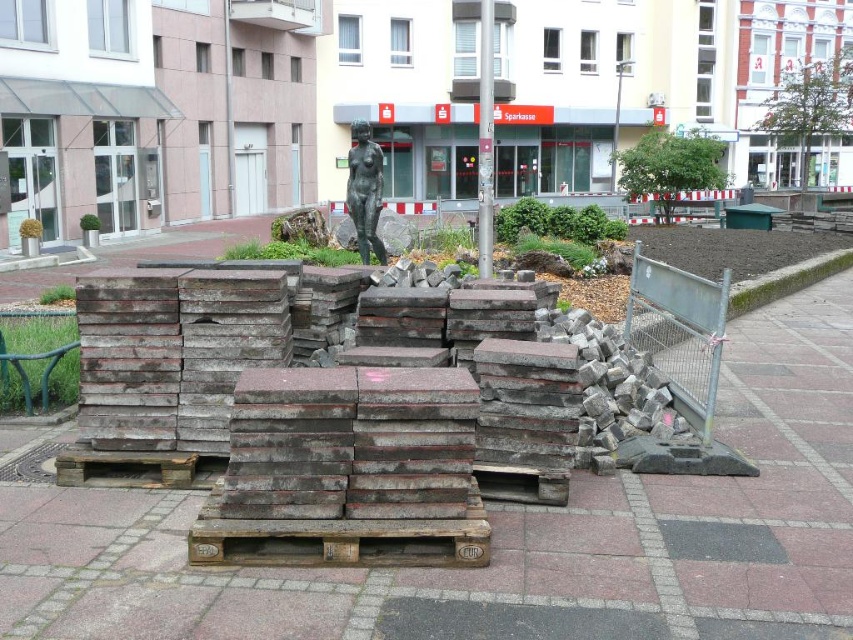
Between point (9, 464) and point (381, 246), which one is positioned behind?

Point (381, 246)

What are the coordinates of `dark gray concrete paving stones at center` in the screenshot? It's located at (500, 536).